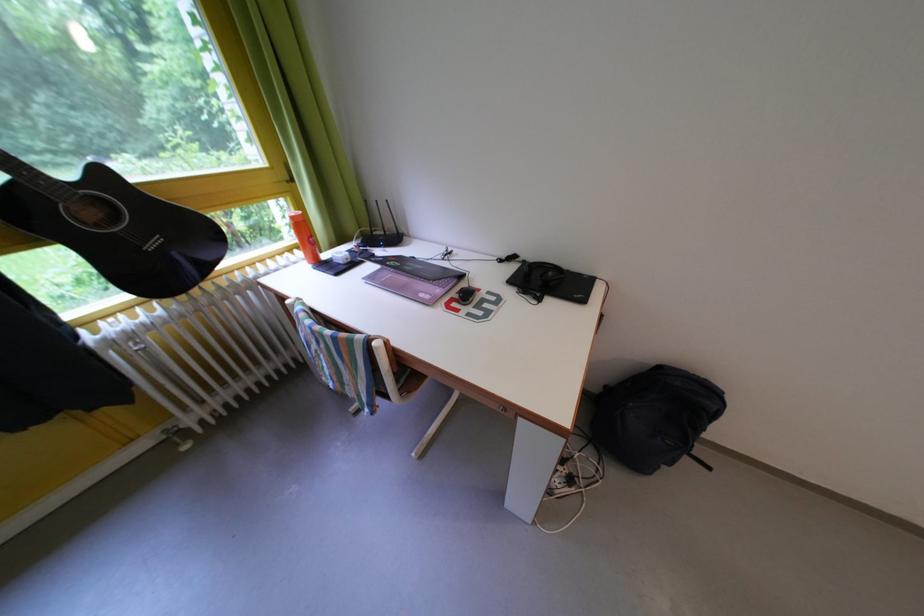
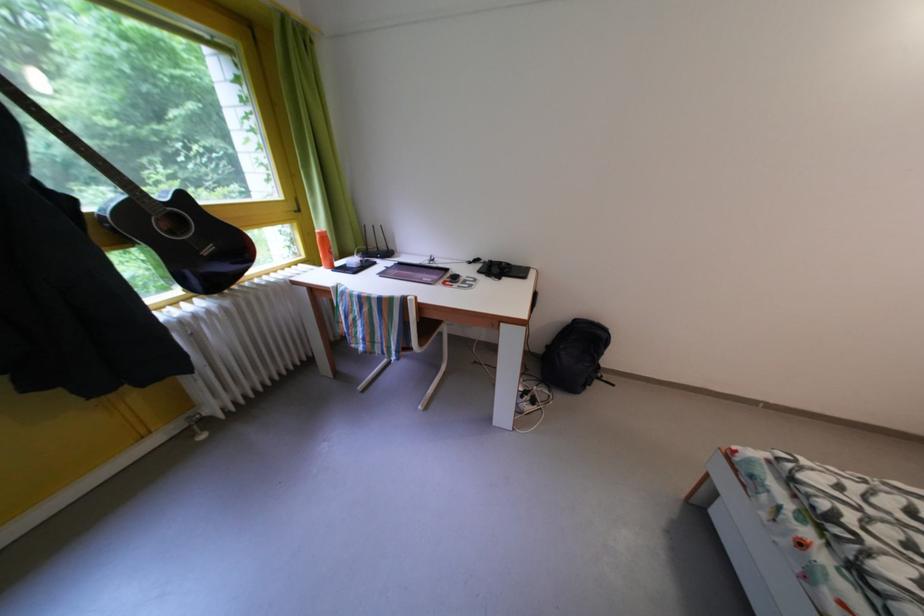
Locate, in the second image, the point that corresponds to [112,179] in the first image.

(191, 203)